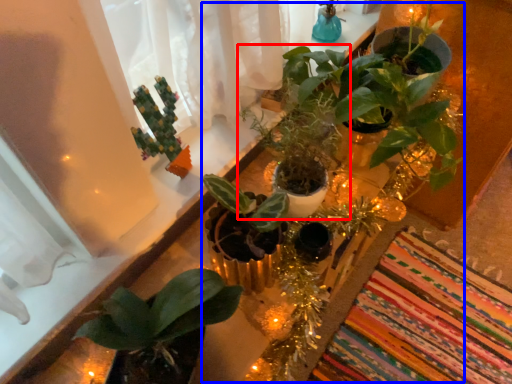
Question: Which object is further to the camera taking this photo, houseplant (highlighted by a red box) or floral arrangement (highlighted by a blue box)?

Choices:
 (A) houseplant
 (B) floral arrangement

Answer: (A)